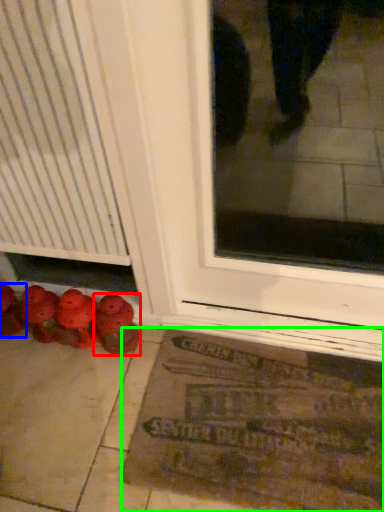
Question: Considering the real-world distances, which object is farthest from footwear (highlighted by a red box)? footwear (highlighted by a blue box) or bath mat (highlighted by a green box)?

Choices:
 (A) footwear
 (B) bath mat

Answer: (B)